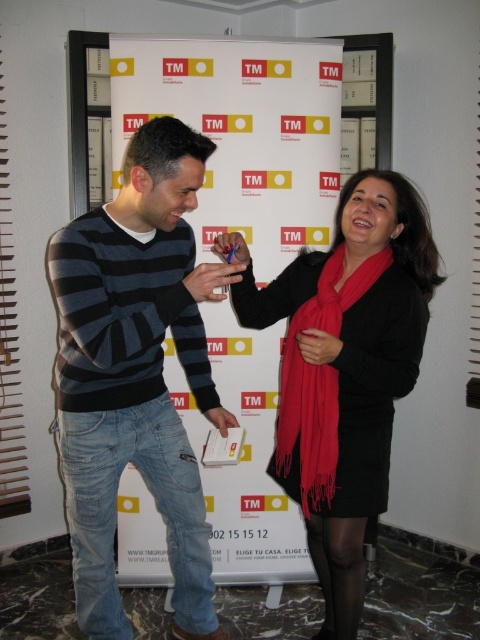
You are a fashion designer observing the scene. You need to determine which item, the matte black dress at center or the red matte scarf at center, would require more fabric to produce. Which one would it be?

The matte black dress at center has a larger size compared to the red matte scarf at center, so it would require more fabric to produce.

You are organizing a display in a store and need to place the matte black phone at center and matte white book at center on a shelf. According to the image, which item should be placed to the right side of the shelf?

The matte black phone at center should be placed to the right of the matte white book at center on the shelf.